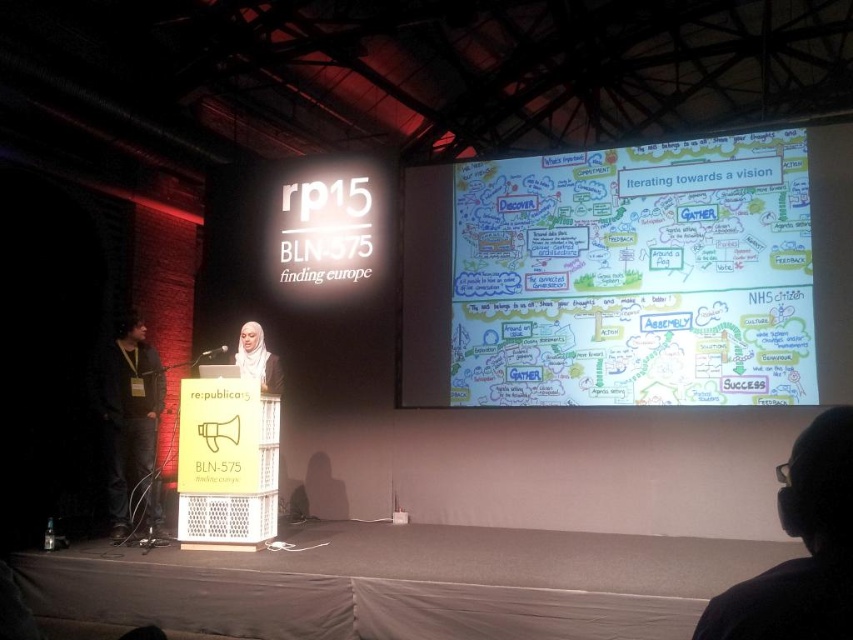
You are an event planner standing at the back of the conference hall. You need to adjust the lighting so that the white paperboard at upper center is clearly visible to all attendees. Given that the lighting equipment can effectively illuminate objects up to 5 meters away, will the current distance of 5.25 meters be a problem?

The white paperboard at upper center is 5.25 meters away from the camera, which exceeds the 5 meters effective range of the lighting equipment. Therefore, the current distance will make it difficult for the lighting to sufficiently illuminate the white paperboard at upper center, potentially causing visibility issues for attendees.

You are an attendee at this presentation and need to take a photo of the white paperboard at upper center and the matte white hijab at center. Which object will appear larger in your photo?

The white paperboard at upper center will appear larger in the photo because it is taller than the matte white hijab at center.

You are an event planner setting up for a presentation. You need to place a 10 feet long banner between the white paperboard at upper center and the black fabric at left. Will the banner fit without overlapping either object?

The distance between the white paperboard at upper center and the black fabric at left is 9.77 feet. Since the banner is 10 feet long, it will not fit without overlapping because the banner is slightly longer than the space available.